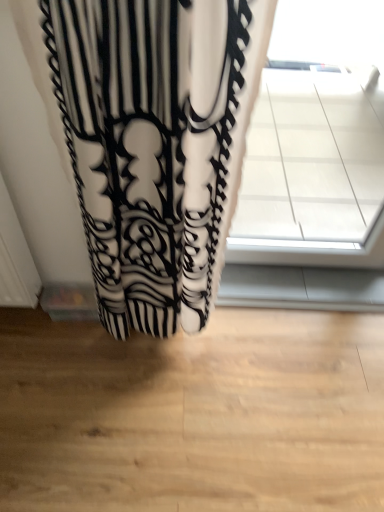
At what (x,y) coordinates should I click in order to perform the action: click on free area below white tile at upper right (from a real-world perspective). Please return your answer as a coordinate pair (x, y). Looking at the image, I should click on (309, 270).